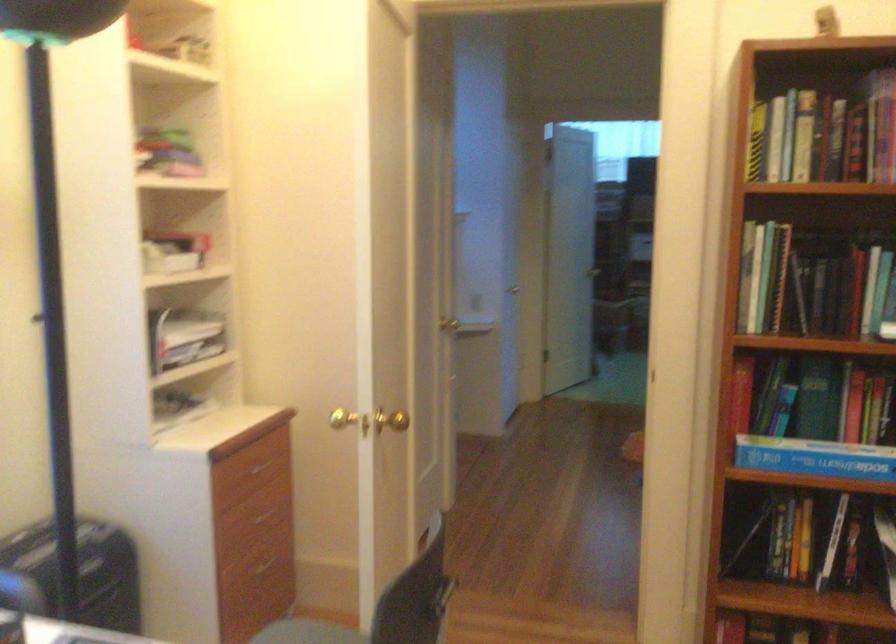
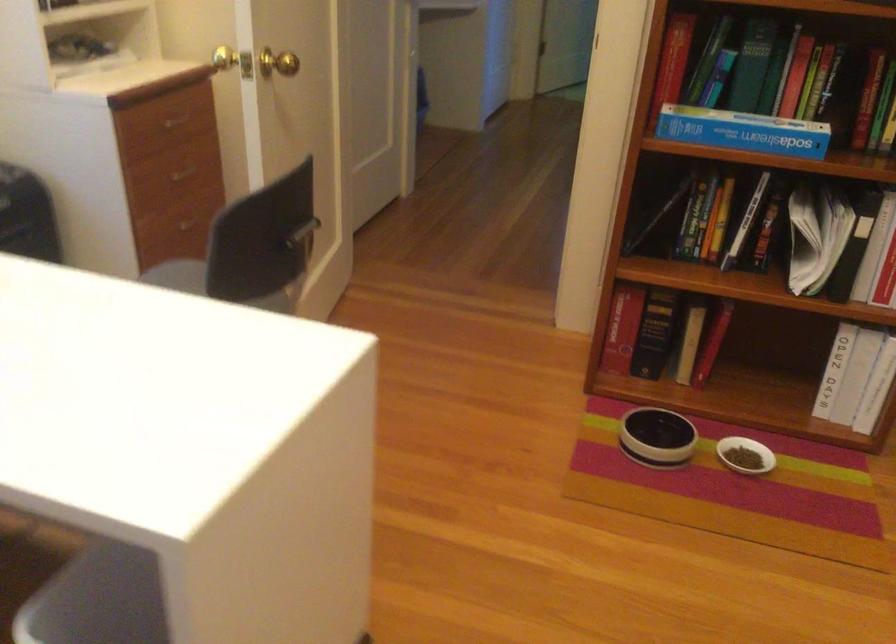
Where in the second image is the point corresponding to pixel 817 458 from the first image?

(743, 131)